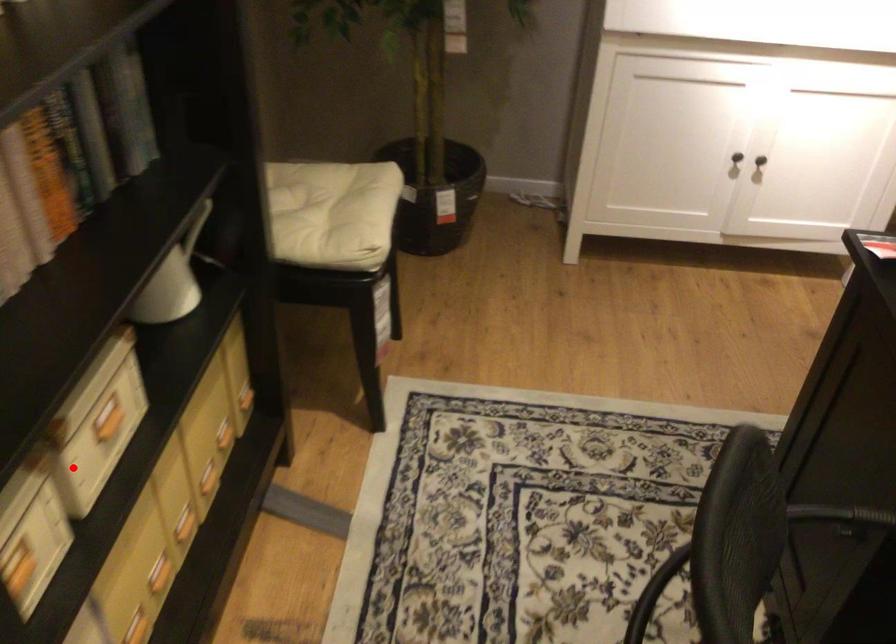
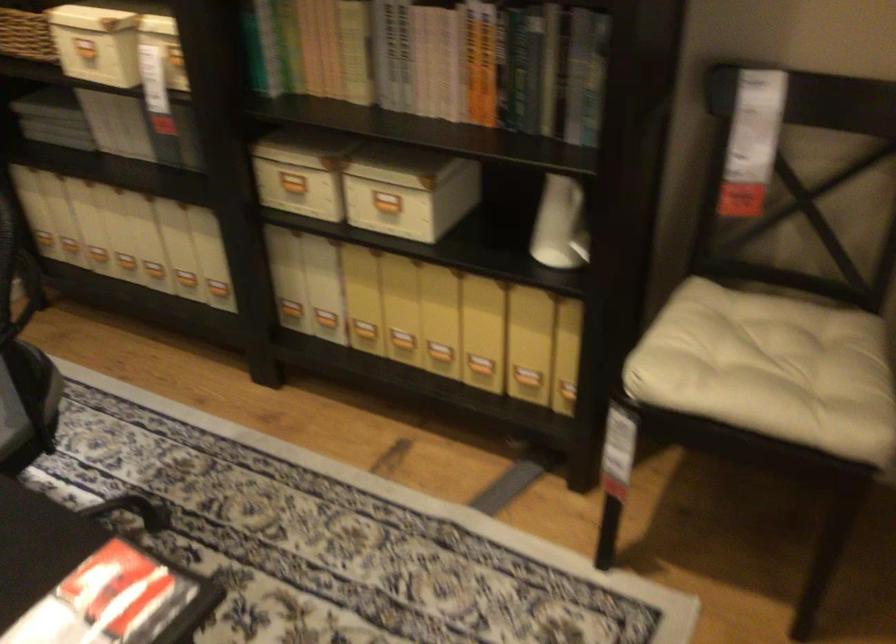
Question: I am providing you with two images of the same scene from different viewpoints. A red point is marked on the first image. Can you still see the location of the red point in image 2?

Choices:
 (A) Yes
 (B) No

Answer: (A)